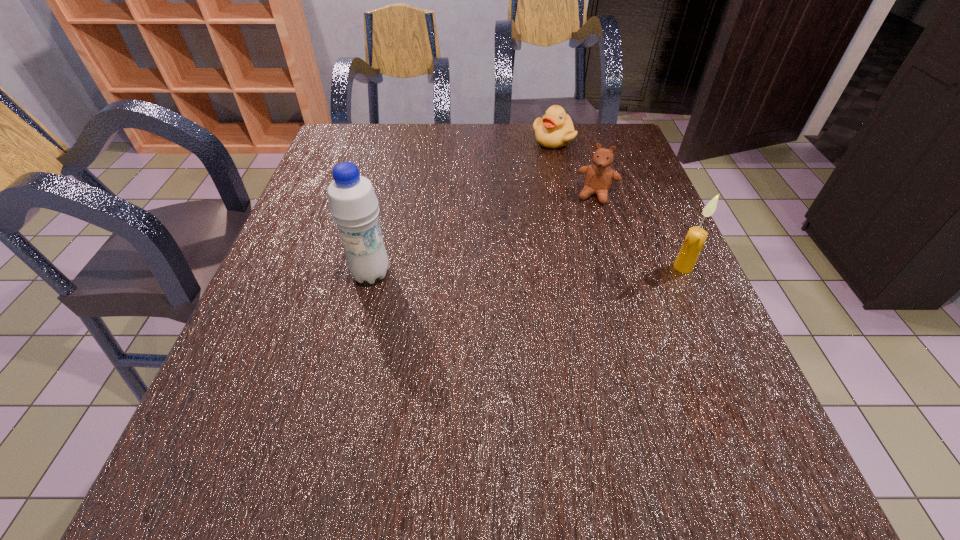
In the image, there is a desktop. Identify the location of vacant space at the near edge. (606, 434).

Where is `free space at the left edge`? This screenshot has width=960, height=540. free space at the left edge is located at coordinates (361, 174).

In the image, there is a desktop. Where is `vacant area at the right edge`? vacant area at the right edge is located at coordinates (658, 296).

Where is `vacant space at the far left corner`? Image resolution: width=960 pixels, height=540 pixels. vacant space at the far left corner is located at coordinates click(x=337, y=139).

In the image, there is a desktop. Where is `free region at the near left corner`? The image size is (960, 540). free region at the near left corner is located at coordinates (215, 416).

Locate an element on the screen. Image resolution: width=960 pixels, height=540 pixels. vacant space at the far right corner of the desktop is located at coordinates (612, 125).

Where is `free space between the leftmost object and the second tallest object`? free space between the leftmost object and the second tallest object is located at coordinates (527, 271).

Locate an element on the screen. vacant region between the rightmost object and the third nearest object is located at coordinates (640, 231).

Identify the location of free area in between the duckling and the leftmost object. The width and height of the screenshot is (960, 540). (462, 207).

The height and width of the screenshot is (540, 960). I want to click on free spot between the shortest object and the teddy bear, so click(x=575, y=167).